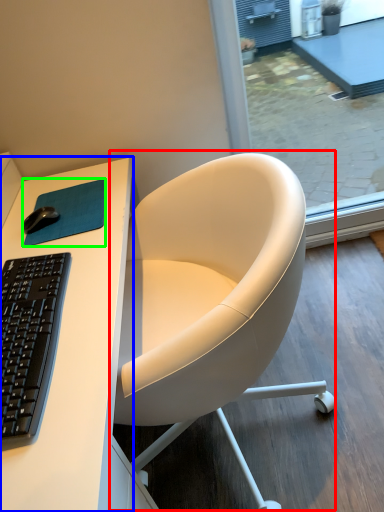
Question: Based on their relative distances, which object is nearer to chair (highlighted by a red box)? Choose from desk (highlighted by a blue box) and mousepad (highlighted by a green box).

Choices:
 (A) desk
 (B) mousepad

Answer: (A)